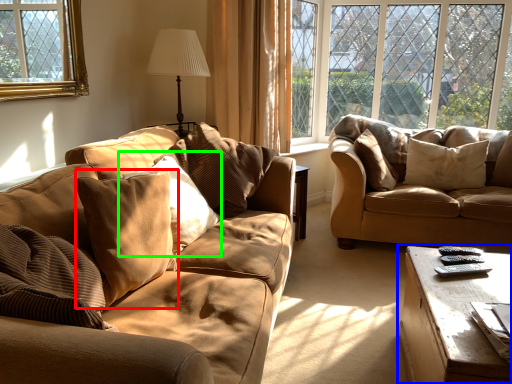
Question: Which object is positioned closest to pillow (highlighted by a red box)? Select from table (highlighted by a blue box) and pillow (highlighted by a green box).

Choices:
 (A) table
 (B) pillow

Answer: (B)